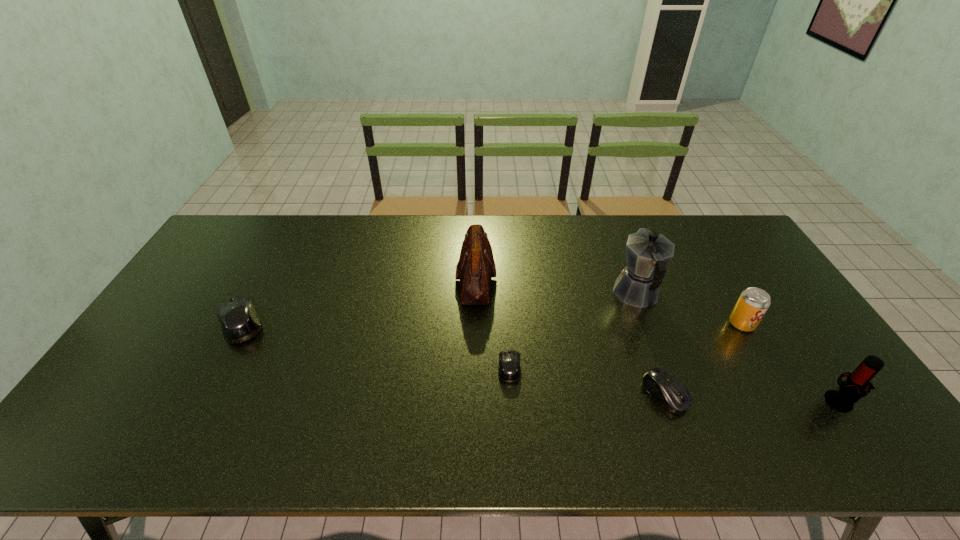
Please point a location where one more mouse_(computer_equipment) can be added evenly. Please provide its 2D coordinates. Your answer should be formatted as a tuple, i.e. [(x, y)], where the tuple contains the x and y coordinates of a point satisfying the conditions above.

[(369, 345)]